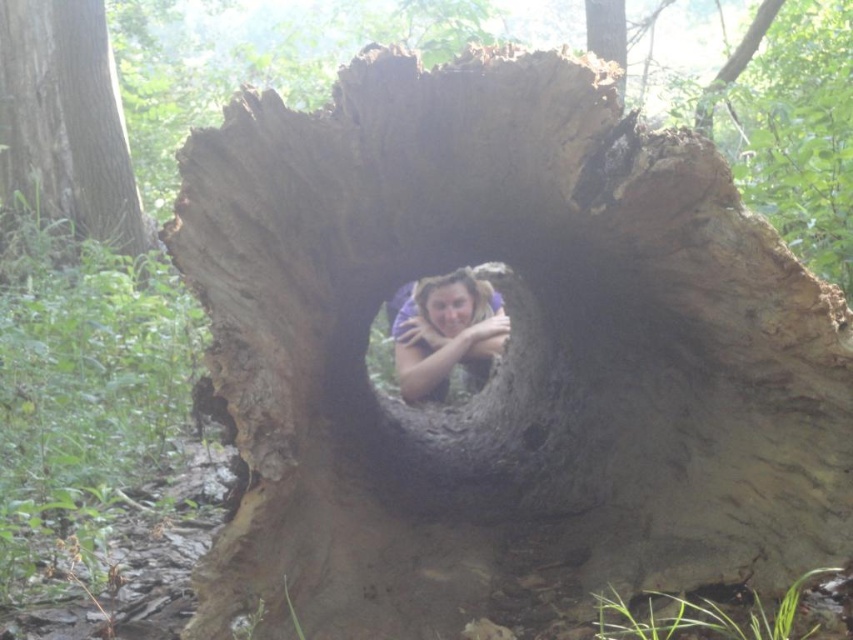
Question: Which object appears closest to the camera in this image?

Choices:
 (A) smooth brown tree trunk at center
 (B) matte purple shirt at center

Answer: (B)

Question: Can you confirm if smooth brown tree trunk at center is wider than matte purple shirt at center?

Choices:
 (A) yes
 (B) no

Answer: (A)

Question: Does smooth brown tree trunk at center lie behind matte purple shirt at center?

Choices:
 (A) no
 (B) yes

Answer: (B)

Question: Is smooth brown tree trunk at center positioned before matte purple shirt at center?

Choices:
 (A) yes
 (B) no

Answer: (B)